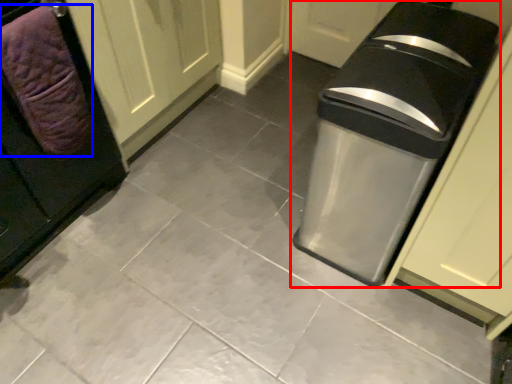
Question: Which object is closer to the camera taking this photo, waste container (highlighted by a red box) or blanket (highlighted by a blue box)?

Choices:
 (A) waste container
 (B) blanket

Answer: (A)